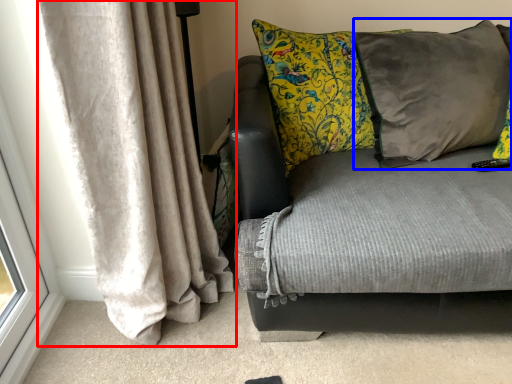
Question: Which object is closer to the camera taking this photo, curtain (highlighted by a red box) or pillow (highlighted by a blue box)?

Choices:
 (A) curtain
 (B) pillow

Answer: (A)